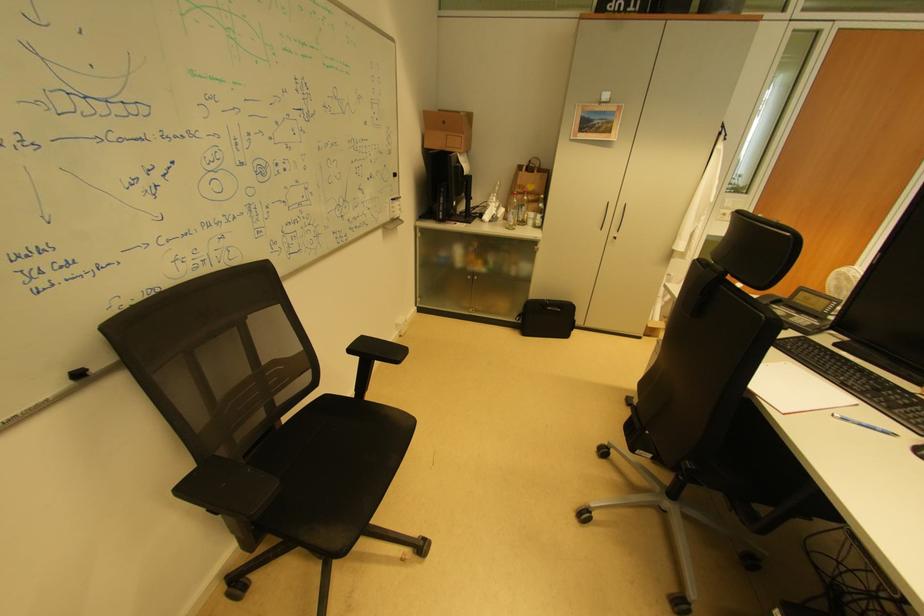
At what (x,y) coordinates should I click in order to perform the action: click on telephone handset. Please return your answer as a coordinate pair (x, y). Looking at the image, I should click on (769, 299).